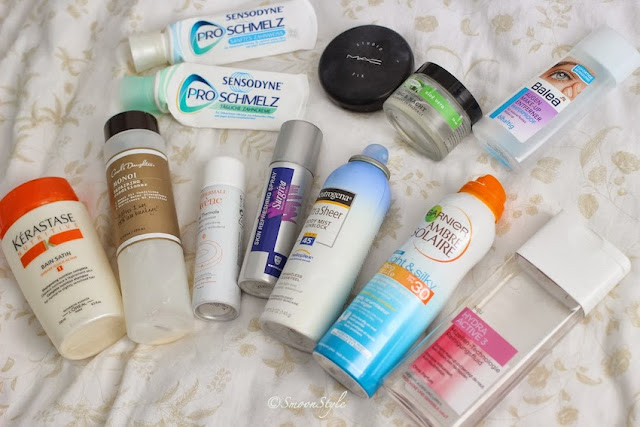
The height and width of the screenshot is (427, 640). In order to click on bed sheet in this screenshot , I will do `click(225, 421)`, `click(233, 391)`.